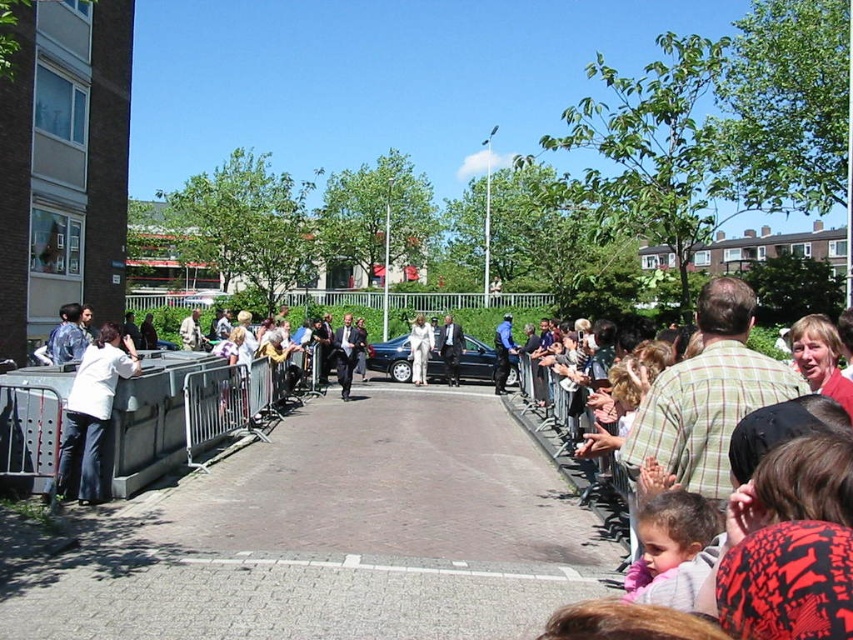
You are a photographer standing on the pathway and want to take a photo of the silver metallic barrier at left and the white fabric jacket at left. Which object should you focus on first if you want to capture both in a single frame without moving the camera?

The silver metallic barrier at left is located below the white fabric jacket at left, so you should focus on the white fabric jacket at left first to ensure it stays in the frame while adjusting the camera angle downward to include the silver metallic barrier at left.

You are standing at the center of the pathway and want to move to the silver metallic barrier at left. Which direction should you face to walk directly towards it?

You should face towards the left direction to walk directly towards the silver metallic barrier at left.